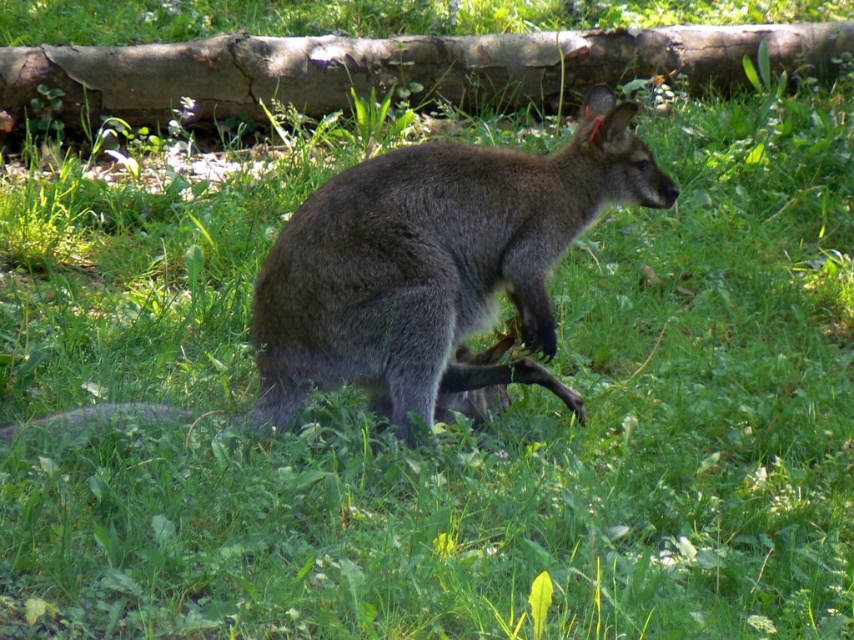
Question: Which point is farther from the camera taking this photo?

Choices:
 (A) (66, 88)
 (B) (589, 122)

Answer: (A)

Question: Is gray fur kangaroo at center above brown rough log at upper center?

Choices:
 (A) yes
 (B) no

Answer: (B)

Question: Considering the relative positions of gray fur kangaroo at center and brown rough log at upper center in the image provided, where is gray fur kangaroo at center located with respect to brown rough log at upper center?

Choices:
 (A) left
 (B) right

Answer: (A)

Question: Is gray fur kangaroo at center behind brown rough log at upper center?

Choices:
 (A) yes
 (B) no

Answer: (B)

Question: Which object appears closest to the camera in this image?

Choices:
 (A) gray fur kangaroo at center
 (B) brown rough log at upper center

Answer: (A)